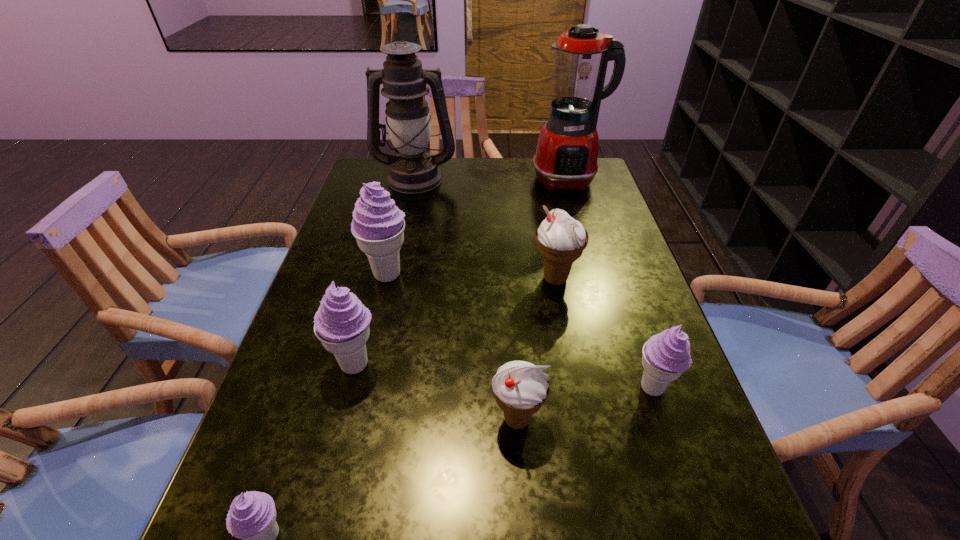
Locate an element on the screen. The image size is (960, 540). food processor is located at coordinates (566, 156).

Locate an element on the screen. oil lamp is located at coordinates (413, 170).

I want to click on the biggest purple icecream, so click(x=378, y=225).

Locate an element on the screen. This screenshot has height=540, width=960. the sixth shortest object is located at coordinates (378, 225).

Identify the location of the farther white icecream. (561, 239).

The image size is (960, 540). Identify the location of the right white icecream. (561, 239).

The height and width of the screenshot is (540, 960). Find the location of `the second biggest purple icecream`. the second biggest purple icecream is located at coordinates (342, 322).

This screenshot has height=540, width=960. What are the coordinates of `the fourth icecream from left to right` in the screenshot? It's located at (520, 388).

The image size is (960, 540). Find the location of `the fifth object from left to right`. the fifth object from left to right is located at coordinates (520, 388).

The image size is (960, 540). What are the coordinates of `the rightmost purple icecream` in the screenshot? It's located at (666, 356).